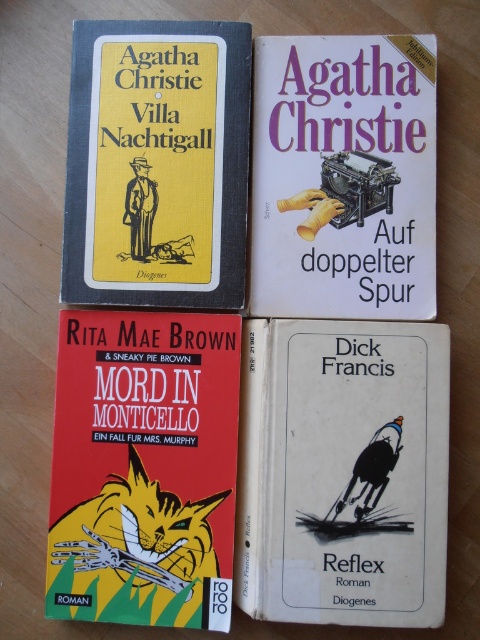
Does yellow matte book cover at upper left appear under white paper book at upper center?

No, yellow matte book cover at upper left is not below white paper book at upper center.

Who is more forward, (104, 113) or (404, 314)?

Point (404, 314) is in front.

Is point (194, 77) positioned after point (312, 292)?

No, it is in front of (312, 292).

Image resolution: width=480 pixels, height=640 pixels. I want to click on yellow matte book cover at upper left, so click(156, 163).

Who is higher up, white matte book at bottom right or red matte book cover at bottom left?

red matte book cover at bottom left is higher up.

Image resolution: width=480 pixels, height=640 pixels. In order to click on white matte book at bottom right in this screenshot , I will do `click(343, 472)`.

Is red matte book cover at bottom left taller than white paper book at upper center?

Yes, red matte book cover at bottom left is taller than white paper book at upper center.

Does red matte book cover at bottom left come in front of white paper book at upper center?

Yes, it is.

Does point (214, 502) come farther from viewer compared to point (273, 144)?

No.

The width and height of the screenshot is (480, 640). In order to click on red matte book cover at bottom left in this screenshot , I will do point(144,468).